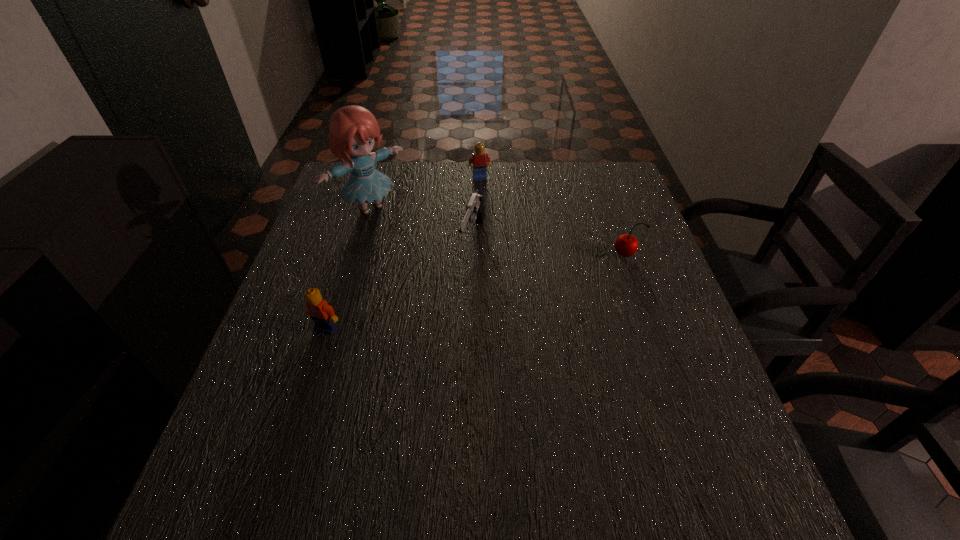
Find the location of a particular element. This screenshot has height=540, width=960. object that can be found as the closest to the left Lego is located at coordinates (475, 210).

At what (x,y) coordinates should I click in order to perform the action: click on the third closest object relative to the rightmost object. Please return your answer as a coordinate pair (x, y). The image size is (960, 540). Looking at the image, I should click on (353, 130).

Where is `free point that satisfies the following two spatial constraints: 1. on the front side of the tallest object; 2. on the left side of the cherry`? The width and height of the screenshot is (960, 540). free point that satisfies the following two spatial constraints: 1. on the front side of the tallest object; 2. on the left side of the cherry is located at coordinates (355, 255).

Image resolution: width=960 pixels, height=540 pixels. Identify the location of free region that satisfies the following two spatial constraints: 1. on the front side of the tallest object; 2. on the left side of the gun. (360, 239).